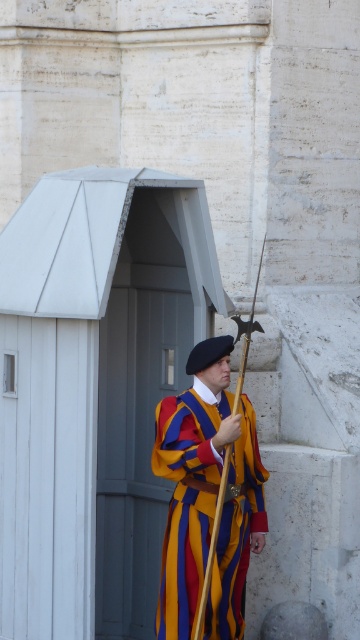
Question: Can you confirm if white painted wood hut at center is positioned to the right of multicolored fabric uniform at center?

Choices:
 (A) no
 (B) yes

Answer: (A)

Question: Which of the following is the farthest from the observer?

Choices:
 (A) white painted wood hut at center
 (B) multicolored fabric uniform at center

Answer: (A)

Question: Can you confirm if white painted wood hut at center is wider than multicolored fabric uniform at center?

Choices:
 (A) no
 (B) yes

Answer: (B)

Question: Can you confirm if white painted wood hut at center is positioned below multicolored fabric uniform at center?

Choices:
 (A) yes
 (B) no

Answer: (B)

Question: Among these points, which one is farthest from the camera?

Choices:
 (A) (232, 522)
 (B) (111, 253)

Answer: (A)